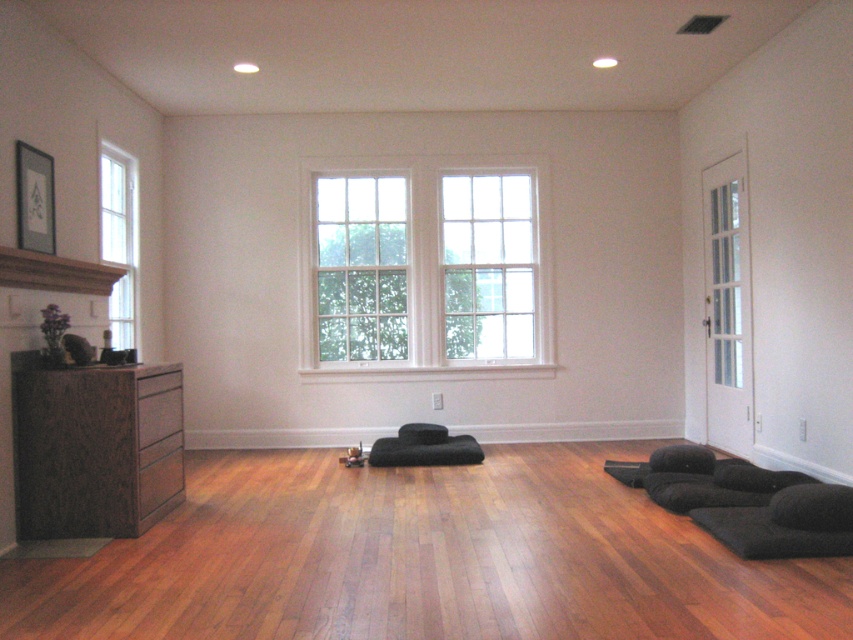
Question: Can you confirm if clear glass window at center is positioned below brown wood mantle at upper left?

Choices:
 (A) no
 (B) yes

Answer: (A)

Question: Estimate the real-world distances between objects in this image. Which object is farther from the dark wood dresser at left?

Choices:
 (A) clear glass window at center
 (B) clear glass window at left
 (C) brown wood mantle at upper left
 (D) white wooden window at center

Answer: (A)

Question: Which object is the closest to the clear glass window at center?

Choices:
 (A) white wooden window at center
 (B) brown wood mantle at upper left
 (C) clear glass window at left
 (D) dark wood dresser at left

Answer: (A)

Question: Estimate the real-world distances between objects in this image. Which object is closer to the clear glass window at left?

Choices:
 (A) white wooden window at center
 (B) clear glass window at center

Answer: (A)

Question: Is clear glass window at center positioned behind brown wood mantle at upper left?

Choices:
 (A) yes
 (B) no

Answer: (A)

Question: Does clear glass window at center appear under clear glass window at left?

Choices:
 (A) yes
 (B) no

Answer: (A)